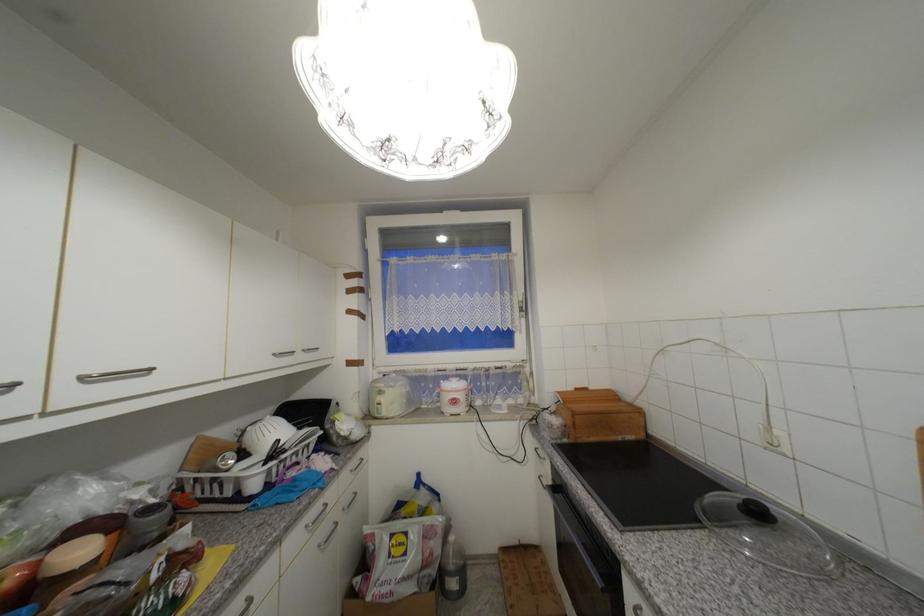
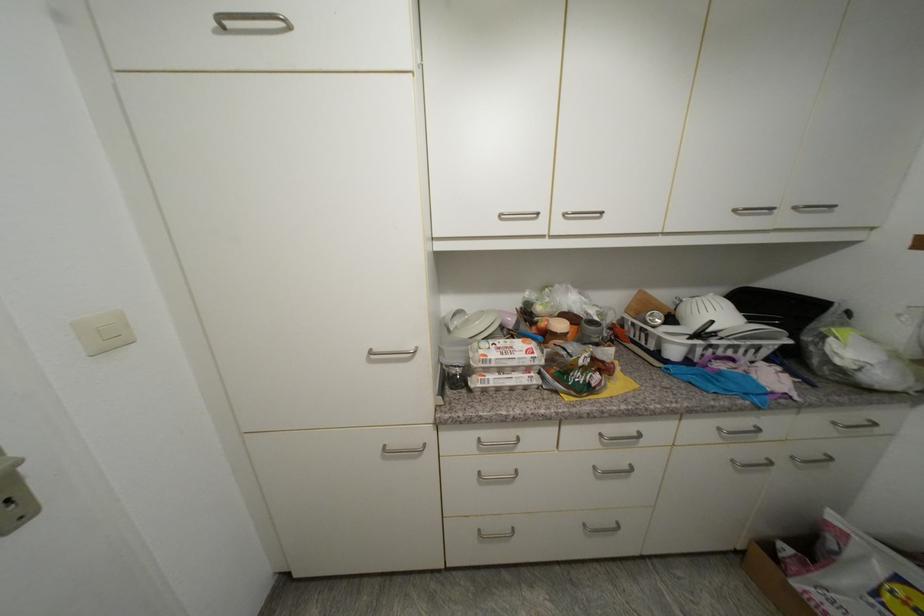
Locate, in the second image, the point that corresponds to point (281, 355) in the first image.

(740, 213)